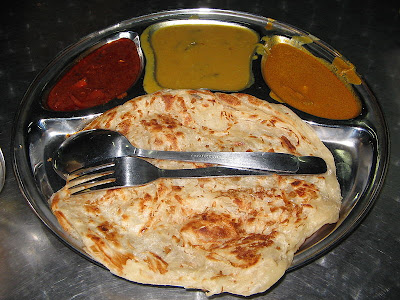
In order to click on handles in this screenshot , I will do `click(225, 157)`, `click(220, 172)`.